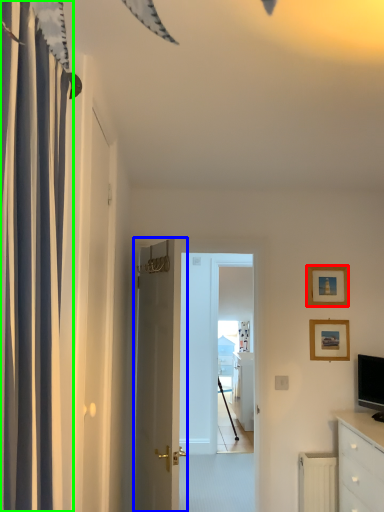
Question: Estimate the real-world distances between objects in this image. Which object is farther from picture frame (highlighted by a red box), door (highlighted by a blue box) or curtain (highlighted by a green box)?

Choices:
 (A) door
 (B) curtain

Answer: (B)